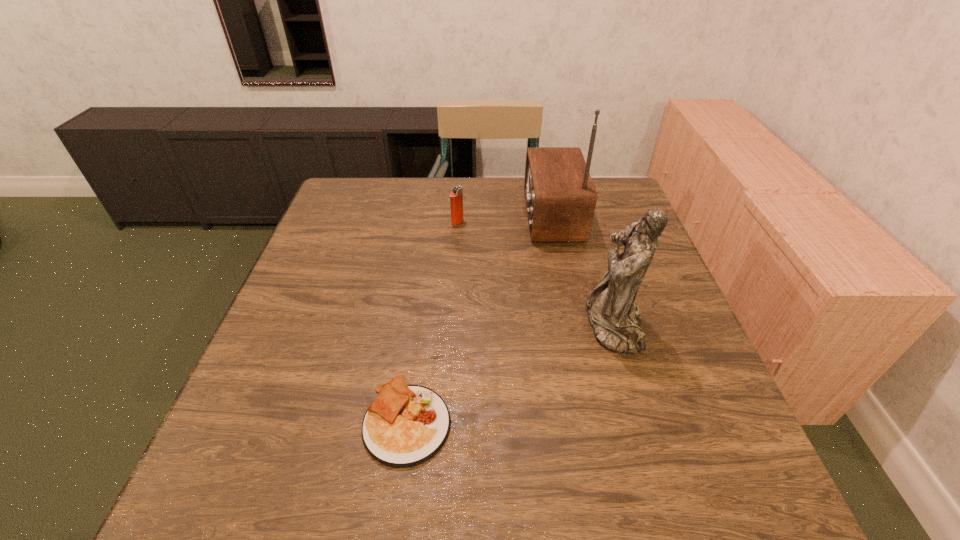
Where is `radio receiver`? The image size is (960, 540). radio receiver is located at coordinates (560, 197).

The image size is (960, 540). Find the location of `figurine`. figurine is located at coordinates (615, 319).

The image size is (960, 540). I want to click on igniter, so click(456, 196).

Locate an element on the screen. the shortest object is located at coordinates (406, 425).

Where is `omelet`? omelet is located at coordinates (406, 425).

The height and width of the screenshot is (540, 960). Identify the location of free space located on the front-facing side of the radio receiver. (413, 215).

This screenshot has height=540, width=960. I want to click on vacant space located on the front-facing side of the radio receiver, so click(476, 215).

The height and width of the screenshot is (540, 960). I want to click on vacant space situated 0.320m on the front-facing side of the radio receiver, so click(410, 215).

Find the location of `free location located on the front-facing side of the second nearest object`. free location located on the front-facing side of the second nearest object is located at coordinates (532, 325).

At what (x,y) coordinates should I click in order to perform the action: click on vacant space located 0.330m on the front-facing side of the second nearest object. Please return your answer as a coordinate pair (x, y). The height and width of the screenshot is (540, 960). Looking at the image, I should click on (434, 325).